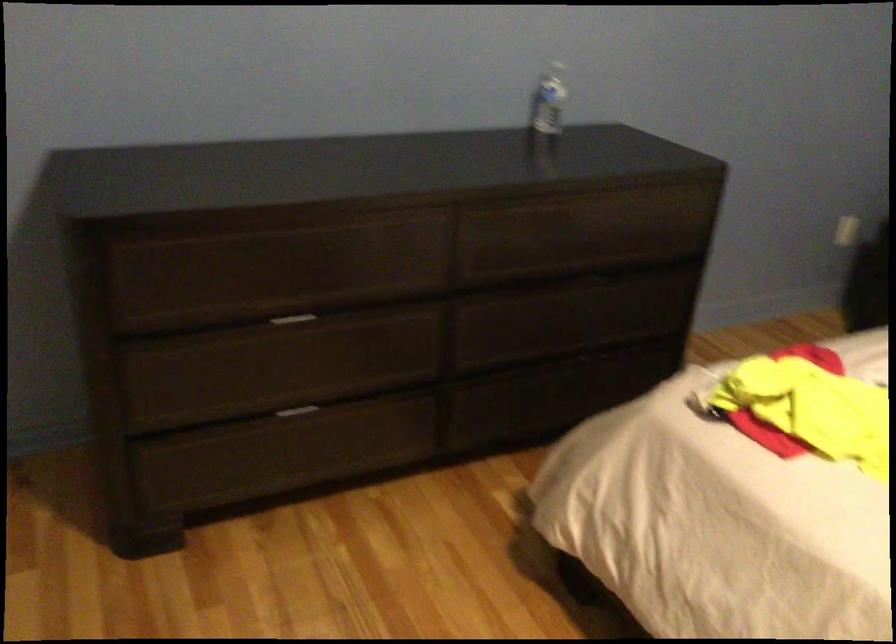
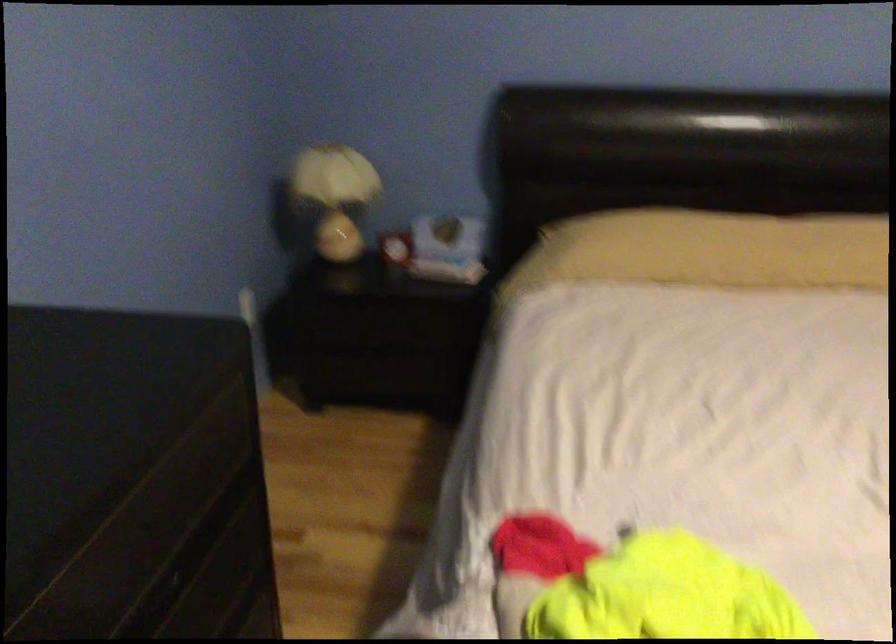
Find the pixel in the second image that matches point (627, 263) in the first image.

(186, 559)